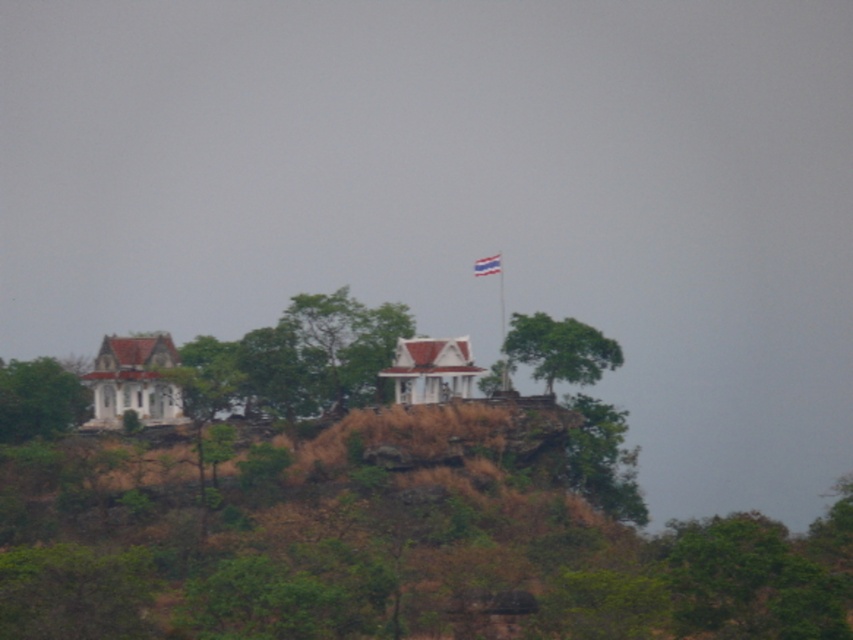
Question: Which of the following is the closest to the observer?

Choices:
 (A) (502, 333)
 (B) (380, 337)
 (C) (589, 333)

Answer: (C)

Question: Where is green leafy tree at left located in relation to blue fabric flag at upper center in the image?

Choices:
 (A) above
 (B) below

Answer: (B)

Question: From the image, what is the correct spatial relationship of green leafy tree at left in relation to green leafy tree at upper center?

Choices:
 (A) below
 (B) above

Answer: (A)

Question: Is blue fabric flag at upper center positioned at the back of white plastic flag pole at upper center?

Choices:
 (A) no
 (B) yes

Answer: (A)

Question: Considering the real-world distances, which object is farthest from the white plastic flag pole at upper center?

Choices:
 (A) green leafy tree at left
 (B) green leafy tree at upper center

Answer: (B)

Question: Which point is closer to the camera?

Choices:
 (A) green leafy tree at center
 (B) green leafy tree at left
 (C) green leafy tree at upper center

Answer: (B)